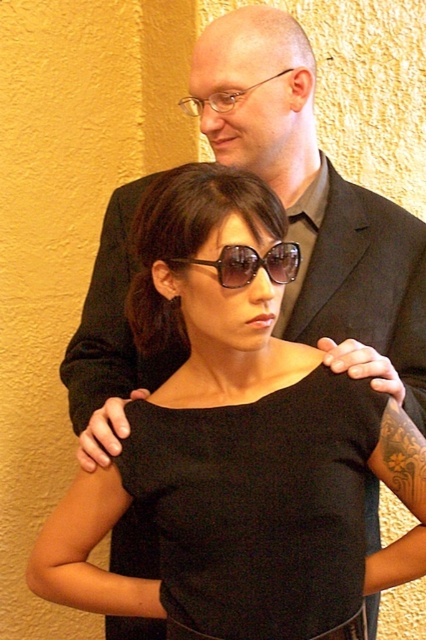
Question: Where is black matte dress at center located in relation to sunglasses at center in the image?

Choices:
 (A) above
 (B) below

Answer: (B)

Question: Which of these objects is positioned farthest from the sunglasses at center?

Choices:
 (A) black matte dress at center
 (B) clear plastic glasses at upper center
 (C) black matte sunglasses at center

Answer: (A)

Question: In this image, where is black matte dress at center located relative to black matte sunglasses at center?

Choices:
 (A) above
 (B) below

Answer: (B)

Question: Among these points, which one is farthest from the camera?

Choices:
 (A) (247, 257)
 (B) (400, 211)
 (C) (164, 406)
 (D) (187, 100)

Answer: (B)

Question: Is black matte dress at center below clear plastic glasses at upper center?

Choices:
 (A) yes
 (B) no

Answer: (A)

Question: Among these points, which one is farthest from the camera?

Choices:
 (A) (221, 99)
 (B) (172, 609)
 (C) (210, 260)
 (D) (313, 208)

Answer: (D)